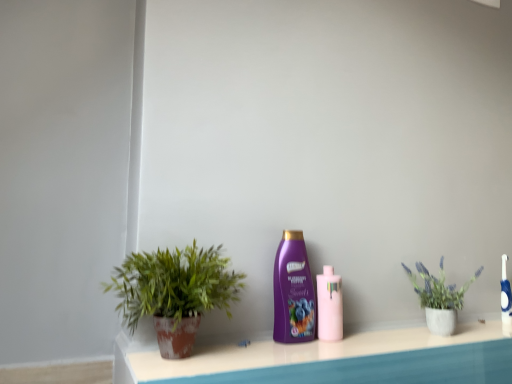
Question: Should I look upward or downward to see green matte plant pot at left, which is the 1th houseplant in front-to-back order?

Choices:
 (A) down
 (B) up

Answer: (A)

Question: From the image's perspective, is pink glossy bottle at center, acting as the 2th bottle starting from the left, on top of purple glossy shampoo at center, the 1th bottle when ordered from left to right?

Choices:
 (A) no
 (B) yes

Answer: (A)

Question: Does pink glossy bottle at center, the first bottle viewed from the right, have a greater height compared to purple glossy shampoo at center, placed as the second bottle when sorted from right to left?

Choices:
 (A) yes
 (B) no

Answer: (B)

Question: Can you confirm if pink glossy bottle at center, the first bottle viewed from the right, is wider than purple glossy shampoo at center, the 1th bottle when ordered from left to right?

Choices:
 (A) no
 (B) yes

Answer: (B)

Question: Is pink glossy bottle at center, acting as the 2th bottle starting from the left, at the right side of purple glossy shampoo at center, placed as the second bottle when sorted from right to left?

Choices:
 (A) yes
 (B) no

Answer: (A)

Question: Is pink glossy bottle at center, acting as the 2th bottle starting from the left, looking in the opposite direction of purple glossy shampoo at center, the 1th bottle when ordered from left to right?

Choices:
 (A) no
 (B) yes

Answer: (A)

Question: From a real-world perspective, is pink glossy bottle at center, the first bottle viewed from the right, located beneath purple glossy shampoo at center, placed as the second bottle when sorted from right to left?

Choices:
 (A) yes
 (B) no

Answer: (A)

Question: Is purple glossy shampoo at center, the 1th bottle when ordered from left to right, positioned behind blue glossy toothbrush at right?

Choices:
 (A) yes
 (B) no

Answer: (B)

Question: Considering the relative sizes of purple glossy shampoo at center, placed as the second bottle when sorted from right to left, and blue glossy toothbrush at right in the image provided, is purple glossy shampoo at center, placed as the second bottle when sorted from right to left, taller than blue glossy toothbrush at right?

Choices:
 (A) yes
 (B) no

Answer: (A)

Question: Can you confirm if purple glossy shampoo at center, the 1th bottle when ordered from left to right, is wider than blue glossy toothbrush at right?

Choices:
 (A) no
 (B) yes

Answer: (B)

Question: From the image's perspective, is purple glossy shampoo at center, the 1th bottle when ordered from left to right, below blue glossy toothbrush at right?

Choices:
 (A) yes
 (B) no

Answer: (B)

Question: Considering the relative sizes of purple glossy shampoo at center, the 1th bottle when ordered from left to right, and blue glossy toothbrush at right in the image provided, is purple glossy shampoo at center, the 1th bottle when ordered from left to right, shorter than blue glossy toothbrush at right?

Choices:
 (A) yes
 (B) no

Answer: (B)

Question: From a real-world perspective, is purple glossy shampoo at center, placed as the second bottle when sorted from right to left, over blue glossy toothbrush at right?

Choices:
 (A) yes
 (B) no

Answer: (A)

Question: Is the depth of green matte plant pot at left, the second houseplant in the back-to-front sequence, greater than that of matte concrete pot at right, which is the second houseplant in left-to-right order?

Choices:
 (A) no
 (B) yes

Answer: (A)